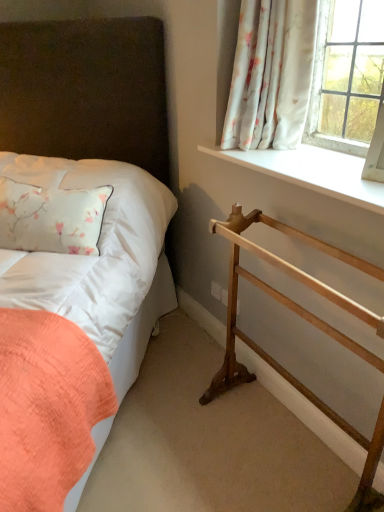
Question: Is white smooth window sill at upper right positioned before white satin pillow at left?

Choices:
 (A) no
 (B) yes

Answer: (B)

Question: Are white smooth window sill at upper right and white satin pillow at left beside each other?

Choices:
 (A) yes
 (B) no

Answer: (B)

Question: Is white smooth window sill at upper right positioned far away from white satin pillow at left?

Choices:
 (A) no
 (B) yes

Answer: (A)

Question: Is white smooth window sill at upper right further to camera compared to white satin pillow at left?

Choices:
 (A) yes
 (B) no

Answer: (B)

Question: From the image's perspective, is white smooth window sill at upper right beneath white satin pillow at left?

Choices:
 (A) yes
 (B) no

Answer: (B)

Question: Is wooden towel rack at lower right taller or shorter than matte white bed at left?

Choices:
 (A) short
 (B) tall

Answer: (A)

Question: Looking at the image, does wooden towel rack at lower right seem bigger or smaller compared to matte white bed at left?

Choices:
 (A) big
 (B) small

Answer: (B)

Question: Would you say wooden towel rack at lower right is inside or outside matte white bed at left?

Choices:
 (A) outside
 (B) inside

Answer: (A)

Question: In the image, is wooden towel rack at lower right positioned in front of or behind matte white bed at left?

Choices:
 (A) front
 (B) behind

Answer: (B)

Question: Considering the positions of wooden towel rack at lower right and white floral fabric at upper right in the image, is wooden towel rack at lower right taller or shorter than white floral fabric at upper right?

Choices:
 (A) tall
 (B) short

Answer: (A)

Question: Based on their sizes in the image, would you say wooden towel rack at lower right is bigger or smaller than white floral fabric at upper right?

Choices:
 (A) small
 (B) big

Answer: (B)

Question: From a real-world perspective, is wooden towel rack at lower right physically located above or below white floral fabric at upper right?

Choices:
 (A) above
 (B) below

Answer: (B)

Question: Considering their positions, is wooden towel rack at lower right located in front of or behind white floral fabric at upper right?

Choices:
 (A) behind
 (B) front

Answer: (B)

Question: Is point (x=155, y=279) positioned closer to the camera than point (x=102, y=322)?

Choices:
 (A) closer
 (B) farther

Answer: (B)

Question: Considering the positions of matte white bed at left and white satin pillow at left in the image, is matte white bed at left taller or shorter than white satin pillow at left?

Choices:
 (A) short
 (B) tall

Answer: (B)